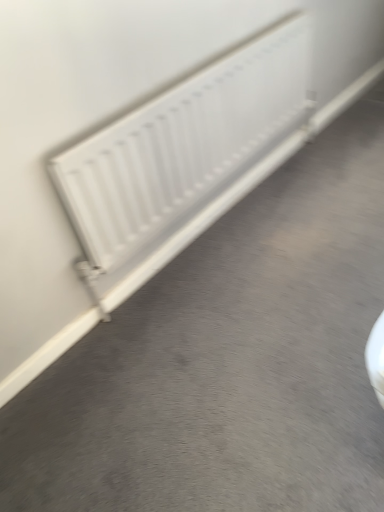
Identify the location of vacant area to the right of white matte radiator at center. (313, 190).